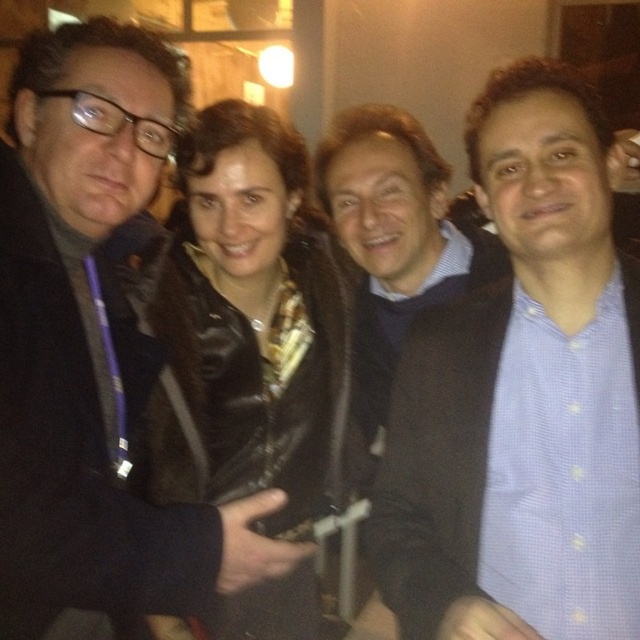
In the image, there is a point marked at coordinates (x=522, y=397). Based on the scene description, what object or clothing item is located at this point?

The point at (x=522, y=397) marks the blue checkered shirt at center.

You are trying to identify the clothing items in the photo. Which clothing item is positioned to the right of the other between the blue checkered shirt at center and the black leather jacket at center?

The blue checkered shirt at center is positioned to the right of the black leather jacket at center.

You are standing in the room where the photo was taken. You see a point at coordinates (92, 353). Which object is this point located on?

The point at coordinates (92, 353) is located on the matte black coat at left.